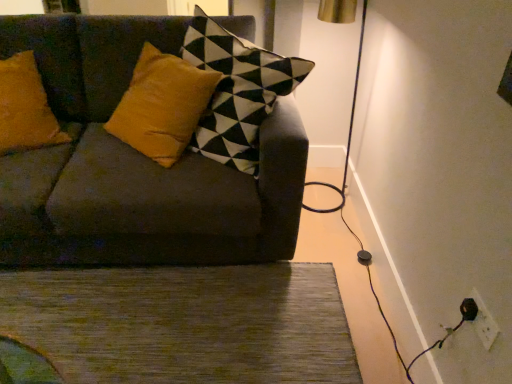
Find the location of a particular element. This screenshot has width=512, height=384. vacant space underneath green textured rug at lower center (from a real-world perspective) is located at coordinates (169, 328).